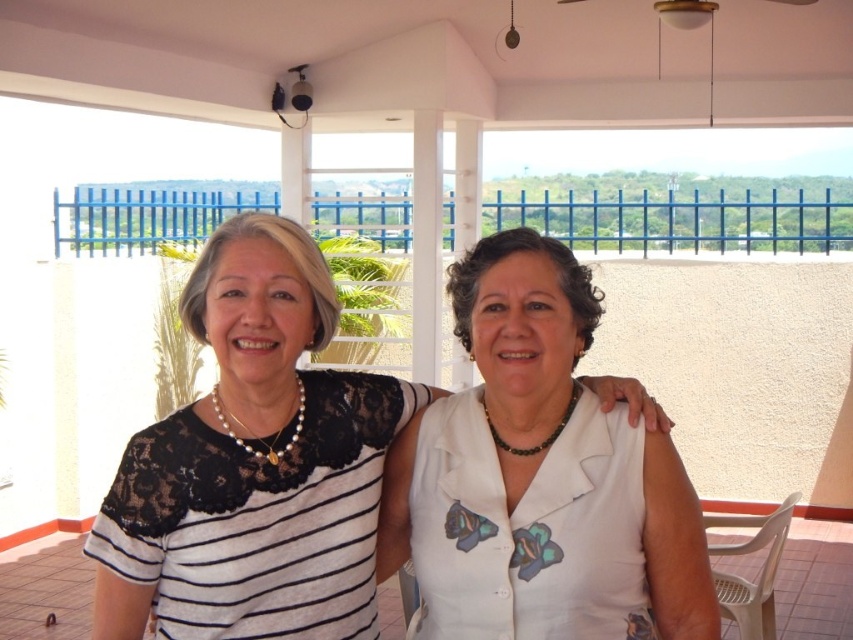
Question: Considering the real-world distances, which object is closest to the white fabric at center?

Choices:
 (A) white lace top at center
 (B) white matte blouse at center

Answer: (B)

Question: Considering the relative positions of white matte blouse at center and white fabric at center in the image provided, where is white matte blouse at center located with respect to white fabric at center?

Choices:
 (A) above
 (B) below

Answer: (A)

Question: Which point is closer to the camera?

Choices:
 (A) (387, 604)
 (B) (431, 525)

Answer: (B)

Question: Can you confirm if white lace top at center is positioned to the right of white fabric at center?

Choices:
 (A) yes
 (B) no

Answer: (B)

Question: Which of these objects is positioned closest to the white lace top at center?

Choices:
 (A) white matte blouse at center
 (B) white fabric at center

Answer: (A)

Question: Can you confirm if white matte blouse at center is bigger than white fabric at center?

Choices:
 (A) no
 (B) yes

Answer: (B)